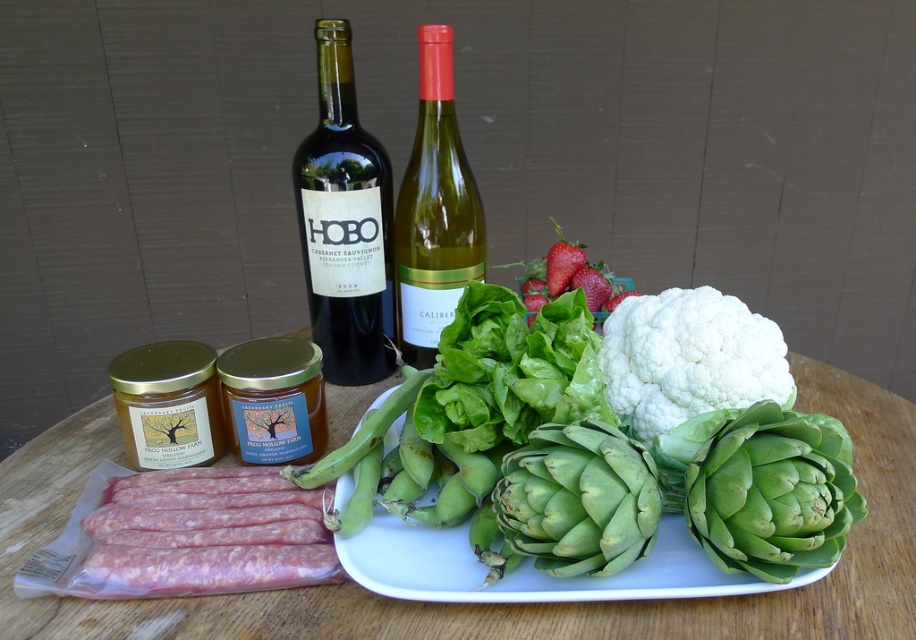
Question: Which of these objects is positioned closest to the white fluffy cauliflower at right?

Choices:
 (A) ripe red strawberries at center
 (B) green leafy artichoke at center
 (C) green rough artichoke at center-right

Answer: (B)

Question: Can you confirm if green matte artichokes at center is smaller than green glass wine at center?

Choices:
 (A) no
 (B) yes

Answer: (A)

Question: Which object appears farthest from the camera in this image?

Choices:
 (A) green rough artichoke at center-right
 (B) ripe red strawberries at center

Answer: (B)

Question: From the image, what is the correct spatial relationship of green leafy artichoke at center in relation to green matte artichokes at center?

Choices:
 (A) below
 (B) above

Answer: (B)

Question: Which point appears closest to the camera in this image?

Choices:
 (A) (345, 355)
 (B) (386, 593)
 (C) (575, 259)
 (D) (677, 420)

Answer: (B)

Question: Can you confirm if dark glass wine bottle at center is positioned below green rough artichoke at center-right?

Choices:
 (A) yes
 (B) no

Answer: (B)